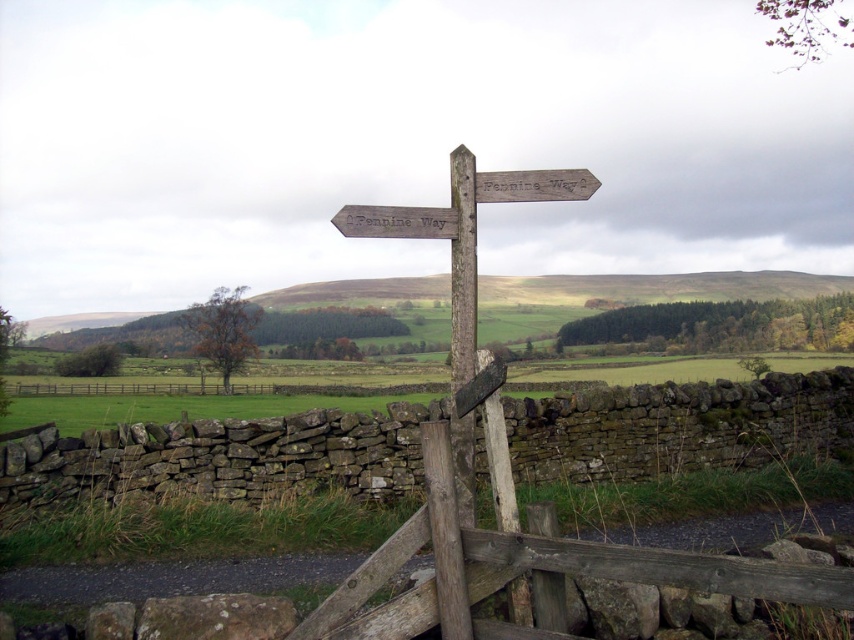
Can you confirm if weathered wood signpost at center is positioned above brown wooden fence at lower left?

Yes.

This screenshot has width=854, height=640. Describe the element at coordinates (463, 268) in the screenshot. I see `weathered wood signpost at center` at that location.

Does point (457, 298) come closer to viewer compared to point (197, 388)?

That is True.

I want to click on weathered wood signpost at center, so click(x=463, y=268).